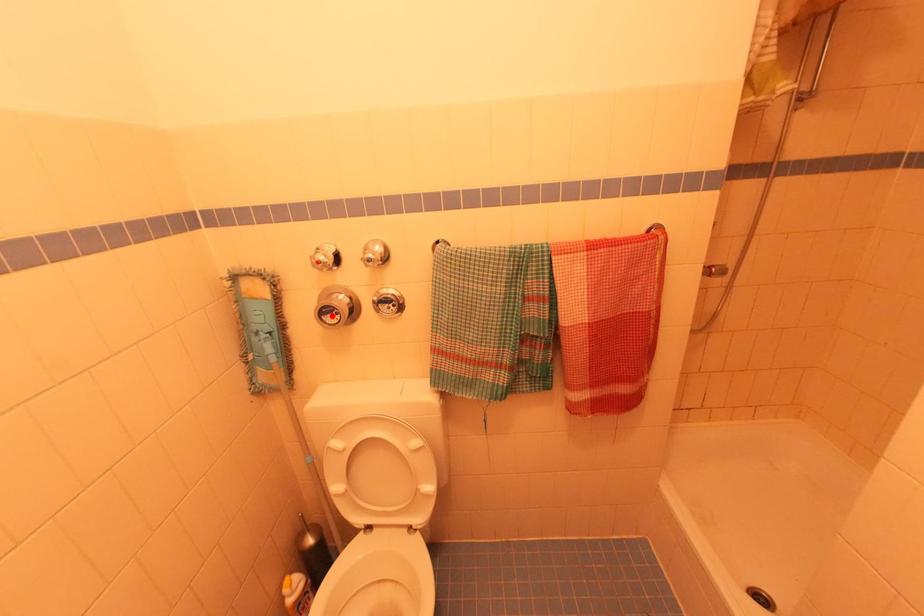
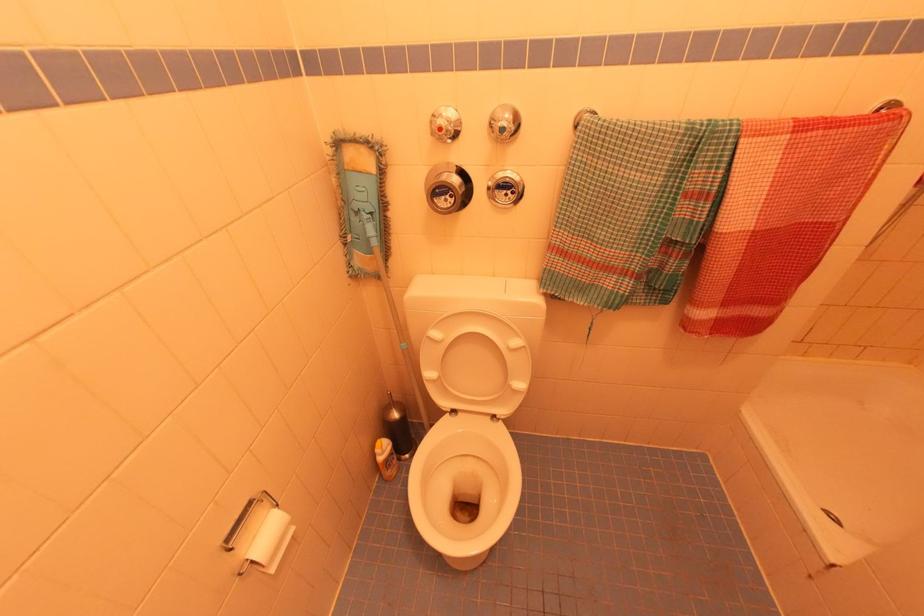
The point at the highlighted location is marked in the first image. Where is the corresponding point in the second image?

(444, 198)